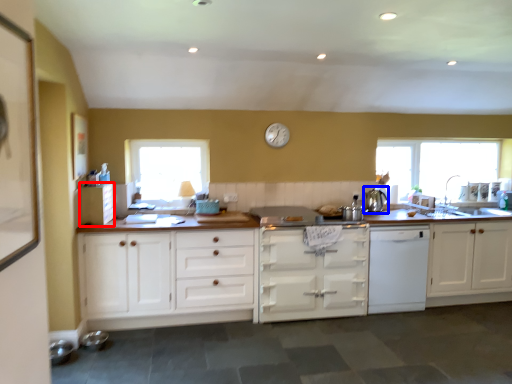
Question: Which object is further to the camera taking this photo, cabinetry (highlighted by a red box) or tea pot (highlighted by a blue box)?

Choices:
 (A) cabinetry
 (B) tea pot

Answer: (B)